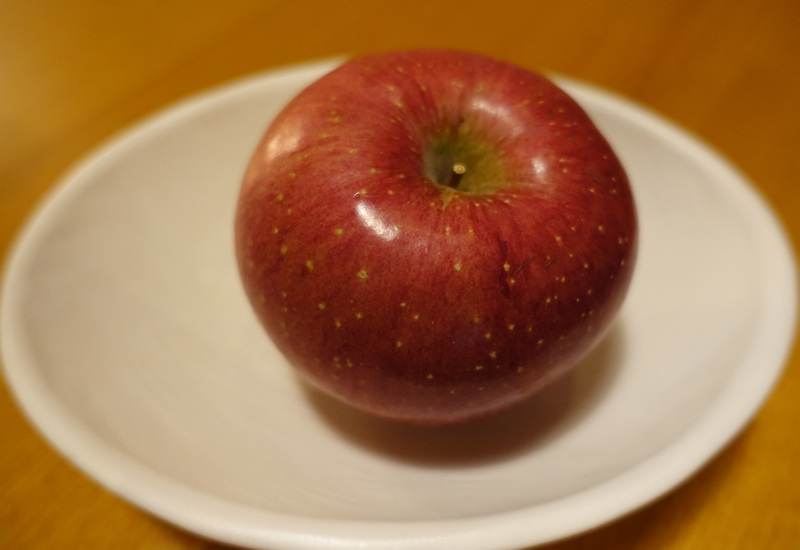
This screenshot has height=550, width=800. I want to click on underneath plate, so click(x=645, y=527).